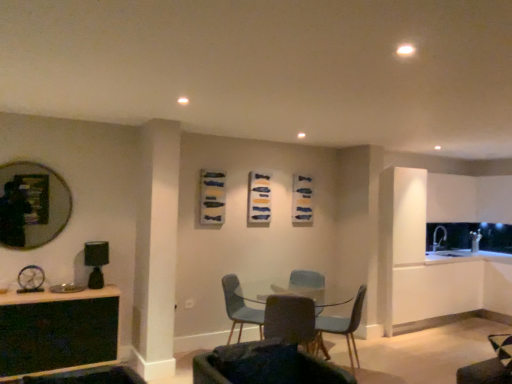
What do you see at coordinates (32, 205) in the screenshot? I see `matte black mirror at left` at bounding box center [32, 205].

The height and width of the screenshot is (384, 512). What do you see at coordinates (290, 320) in the screenshot?
I see `matte gray chair at center, the 2th chair from the front` at bounding box center [290, 320].

The image size is (512, 384). Describe the element at coordinates (240, 306) in the screenshot. I see `clear glass table at center` at that location.

Find the location of a particular element. This screenshot has width=512, height=384. black glass table at lower left is located at coordinates (58, 330).

Which of these two, matte black mirror at left or black glass table at lower left, is smaller?

matte black mirror at left.

Do you think matte black mirror at left is within black glass table at lower left, or outside of it?

The correct answer is: outside.

Which object is positioned more to the right, matte black mirror at left or black glass table at lower left?

Positioned to the right is black glass table at lower left.

From a real-world perspective, which is physically below, matte black mirror at left or black glass table at lower left?

From a 3D spatial view, black glass table at lower left is below.

Identify the location of the 1st chair behind the matte black mirror at left. This screenshot has width=512, height=384. point(342,326).

Which is correct: matte blue chair at center, which ranks as the third chair in front-to-back order, is inside matte black mirror at left, or outside of it?

matte blue chair at center, which ranks as the third chair in front-to-back order, exists outside the volume of matte black mirror at left.

Can you confirm if matte blue chair at center, the 2th chair when ordered from back to front, is smaller than matte black mirror at left?

Incorrect, matte blue chair at center, the 2th chair when ordered from back to front, is not smaller in size than matte black mirror at left.

Is matte blue chair at center, the 2th chair when ordered from back to front, at the right side of matte black mirror at left?

Correct, you'll find matte blue chair at center, the 2th chair when ordered from back to front, to the right of matte black mirror at left.

From the image's perspective, starting from the black matte lamp at left, which chair is the 1st one below? Please provide its 2D coordinates.

[(265, 366)]

How far apart are dark gray fabric chair at center, which ranks as the first chair in front-to-back order, and black matte lamp at left?

2.00 meters.

Which object is further away from the camera taking this photo, dark gray fabric chair at center, which ranks as the first chair in front-to-back order, or black matte lamp at left?

black matte lamp at left is behind.

From the picture: Which point is more distant from viewer, (x=239, y=358) or (x=97, y=249)?

The point (x=97, y=249) is more distant.

From the image's perspective, which one is positioned higher, black glass table at lower left or matte blue chair at center, which ranks as the third chair in front-to-back order?

black glass table at lower left, from the image's perspective.

Could you tell me if black glass table at lower left is facing matte blue chair at center, which ranks as the third chair in front-to-back order?

No, black glass table at lower left is not turned towards matte blue chair at center, which ranks as the third chair in front-to-back order.

From the image's perspective, is matte blue chair at center, which ranks as the first chair in back-to-front order, positioned above or below matte blue chair at center, the 2th chair when ordered from back to front?

Clearly, from the image's perspective, matte blue chair at center, which ranks as the first chair in back-to-front order, is above matte blue chair at center, the 2th chair when ordered from back to front.

Which of these two, matte blue chair at center, which ranks as the first chair in back-to-front order, or matte blue chair at center, the 2th chair when ordered from back to front, is bigger?

matte blue chair at center, the 2th chair when ordered from back to front, is bigger.

Would you consider matte blue chair at center, which ranks as the first chair in back-to-front order, to be distant from matte blue chair at center, which ranks as the third chair in front-to-back order?

No, matte blue chair at center, which ranks as the first chair in back-to-front order, is not far away from matte blue chair at center, which ranks as the third chair in front-to-back order.

Is matte blue chair at center, the 4th chair in the front-to-back sequence, aimed at matte blue chair at center, which ranks as the third chair in front-to-back order?

Yes.

Identify the location of chair that is the 3rd one when counting downward from the dark gray fabric chair at center, which ranks as the first chair in front-to-back order (from the image's perspective). (342, 326).

Is point (306, 379) less distant than point (341, 322)?

Yes, it is in front of point (341, 322).

Would you say dark gray fabric chair at center, which is counted as the 4th chair, starting from the back, is inside or outside matte blue chair at center, the 2th chair when ordered from back to front?

dark gray fabric chair at center, which is counted as the 4th chair, starting from the back, cannot be found inside matte blue chair at center, the 2th chair when ordered from back to front.

Would you consider dark gray fabric chair at center, which ranks as the first chair in front-to-back order, to be distant from matte blue chair at center, which ranks as the third chair in front-to-back order?

That's right, there is a large distance between dark gray fabric chair at center, which ranks as the first chair in front-to-back order, and matte blue chair at center, which ranks as the third chair in front-to-back order.

From the image's perspective, which object appears higher, matte gray armchair at center or matte blue chair at center, the 2th chair when ordered from back to front?

matte gray armchair at center is shown above in the image.

Looking at their sizes, would you say matte gray armchair at center is wider or thinner than matte blue chair at center, the 2th chair when ordered from back to front?

In the image, matte gray armchair at center appears to be more narrow than matte blue chair at center, the 2th chair when ordered from back to front.

Is matte gray armchair at center further to the viewer compared to matte blue chair at center, the 2th chair when ordered from back to front?

Yes, it is behind matte blue chair at center, the 2th chair when ordered from back to front.

The image size is (512, 384). I want to click on mirror behind the black glass table at lower left, so click(32, 205).

Where is `chair that is the 4th object located below the matte black mirror at left (from the image's perspective)`? Image resolution: width=512 pixels, height=384 pixels. chair that is the 4th object located below the matte black mirror at left (from the image's perspective) is located at coordinates (342, 326).

Estimate the real-world distances between objects in this image. Which object is further from clear glass table at center, matte blue chair at center, the 4th chair in the front-to-back sequence, or matte blue chair at center, which ranks as the third chair in front-to-back order?

The object further to clear glass table at center is matte blue chair at center, which ranks as the third chair in front-to-back order.

Estimate the real-world distances between objects in this image. Which object is further from black matte lamp at left, matte black mirror at left or clear glass table at center?

clear glass table at center is further to black matte lamp at left.

Which object lies further to the anchor point matte black mirror at left, clear glass table at center or matte blue chair at center, the 2th chair when ordered from back to front?

Based on the image, matte blue chair at center, the 2th chair when ordered from back to front, appears to be further to matte black mirror at left.

When comparing their distances from dark gray fabric chair at center, which ranks as the first chair in front-to-back order, does clear glass table at center or matte blue chair at center, the 4th chair in the front-to-back sequence, seem closer?

matte blue chair at center, the 4th chair in the front-to-back sequence, is closer to dark gray fabric chair at center, which ranks as the first chair in front-to-back order.

Estimate the real-world distances between objects in this image. Which object is further from matte blue chair at center, which ranks as the first chair in back-to-front order, matte gray chair at center, the 2th chair from the front, or matte blue chair at center, which ranks as the third chair in front-to-back order?

The object further to matte blue chair at center, which ranks as the first chair in back-to-front order, is matte blue chair at center, which ranks as the third chair in front-to-back order.

When comparing their distances from clear glass table at center, does matte gray armchair at center or matte blue chair at center, the 4th chair in the front-to-back sequence, seem further?

matte gray armchair at center.

When comparing their distances from dark gray fabric chair at center, which ranks as the first chair in front-to-back order, does matte gray armchair at center or matte blue chair at center, which ranks as the first chair in back-to-front order, seem closer?

matte blue chair at center, which ranks as the first chair in back-to-front order, lies closer to dark gray fabric chair at center, which ranks as the first chair in front-to-back order, than the other object.

Which object lies nearer to the anchor point dark gray fabric chair at center, which is counted as the 4th chair, starting from the back, matte blue chair at center, which ranks as the first chair in back-to-front order, or matte blue chair at center, which ranks as the third chair in front-to-back order?

matte blue chair at center, which ranks as the first chair in back-to-front order, is closer to dark gray fabric chair at center, which is counted as the 4th chair, starting from the back.

Identify the location of round table situated between matte black mirror at left and matte blue chair at center, the 2th chair when ordered from back to front, from left to right. The width and height of the screenshot is (512, 384). (240, 306).

Find the location of a particular element. Image resolution: width=512 pixels, height=384 pixels. appliance situated between matte black mirror at left and matte gray armchair at center from left to right is located at coordinates (96, 262).

This screenshot has width=512, height=384. Identify the location of armchair located between matte black mirror at left and matte blue chair at center, the 2th chair when ordered from back to front, in the left-right direction. (309, 285).

The image size is (512, 384). I want to click on appliance between matte black mirror at left and dark gray fabric chair at center, which is counted as the 4th chair, starting from the back, from left to right, so click(x=96, y=262).